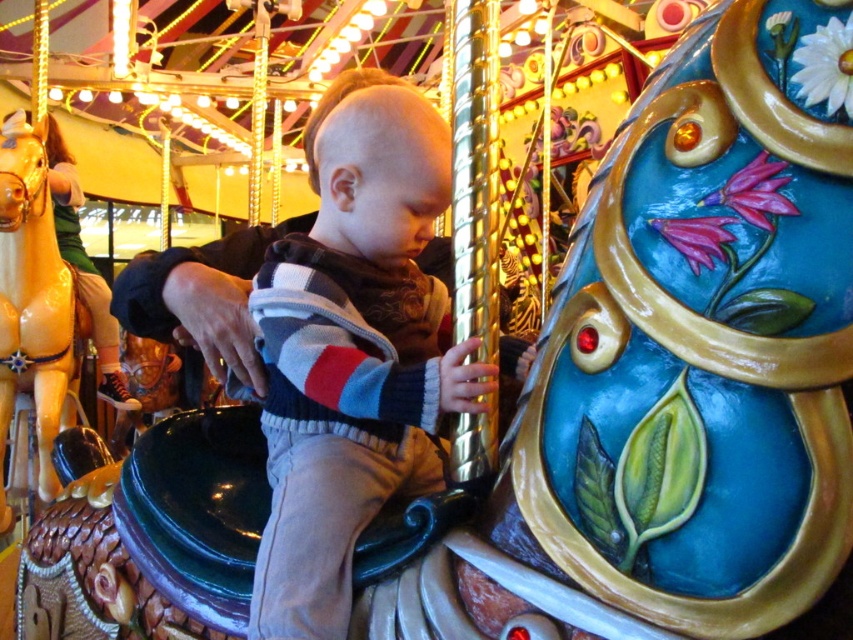
You are a photographer trying to capture a photo of the striped sweater at center and the shiny gold horse at left. If you want to ensure both are fully visible in your shot, which object should you consider the width of when framing the scene?

The striped sweater at center might be wider than the shiny gold horse at left, so you should consider the width of the striped sweater at center to ensure both are fully visible in the shot.

You are a photographer trying to capture the striped sweater at center and the shiny gold horse at left in a single photo. Which object should you focus on first to ensure both are in sharp focus?

You should focus on the striped sweater at center first because it is closer to the viewer than the shiny gold horse at left, ensuring both will be in focus when using a proper aperture setting.